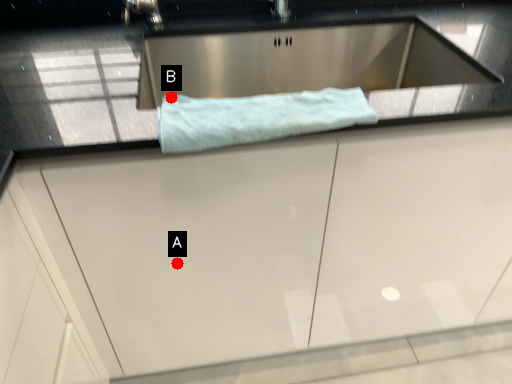
Question: Two points are circled on the image, labeled by A and B beside each circle. Which of the following is the closest to the observer?

Choices:
 (A) A is closer
 (B) B is closer

Answer: (B)